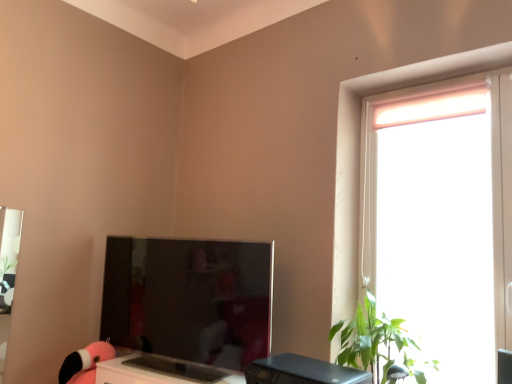
Question: Does black plastic desktop at lower center have a smaller size compared to green leafy plant at right?

Choices:
 (A) no
 (B) yes

Answer: (B)

Question: Considering the relative positions of black plastic desktop at lower center and green leafy plant at right in the image provided, is black plastic desktop at lower center to the right of green leafy plant at right from the viewer's perspective?

Choices:
 (A) yes
 (B) no

Answer: (B)

Question: Does black plastic desktop at lower center have a lesser height compared to green leafy plant at right?

Choices:
 (A) yes
 (B) no

Answer: (A)

Question: Is green leafy plant at right located within black plastic desktop at lower center?

Choices:
 (A) yes
 (B) no

Answer: (B)

Question: From a real-world perspective, is black plastic desktop at lower center positioned over green leafy plant at right based on gravity?

Choices:
 (A) yes
 (B) no

Answer: (B)

Question: Are black plastic desktop at lower center and green leafy plant at right located far from each other?

Choices:
 (A) yes
 (B) no

Answer: (B)

Question: Does green leafy plant at right have a smaller size compared to black plastic desktop at lower center?

Choices:
 (A) yes
 (B) no

Answer: (B)

Question: From the image's perspective, is green leafy plant at right below black plastic desktop at lower center?

Choices:
 (A) no
 (B) yes

Answer: (A)

Question: Is green leafy plant at right completely or partially outside of black plastic desktop at lower center?

Choices:
 (A) yes
 (B) no

Answer: (A)

Question: Considering the relative sizes of green leafy plant at right and black plastic desktop at lower center in the image provided, is green leafy plant at right shorter than black plastic desktop at lower center?

Choices:
 (A) no
 (B) yes

Answer: (A)

Question: Is green leafy plant at right at the left side of black plastic desktop at lower center?

Choices:
 (A) yes
 (B) no

Answer: (B)

Question: Is green leafy plant at right oriented towards black plastic desktop at lower center?

Choices:
 (A) no
 (B) yes

Answer: (B)

Question: From a real-world perspective, is satin black monitor at center physically below black plastic desktop at lower center?

Choices:
 (A) yes
 (B) no

Answer: (B)